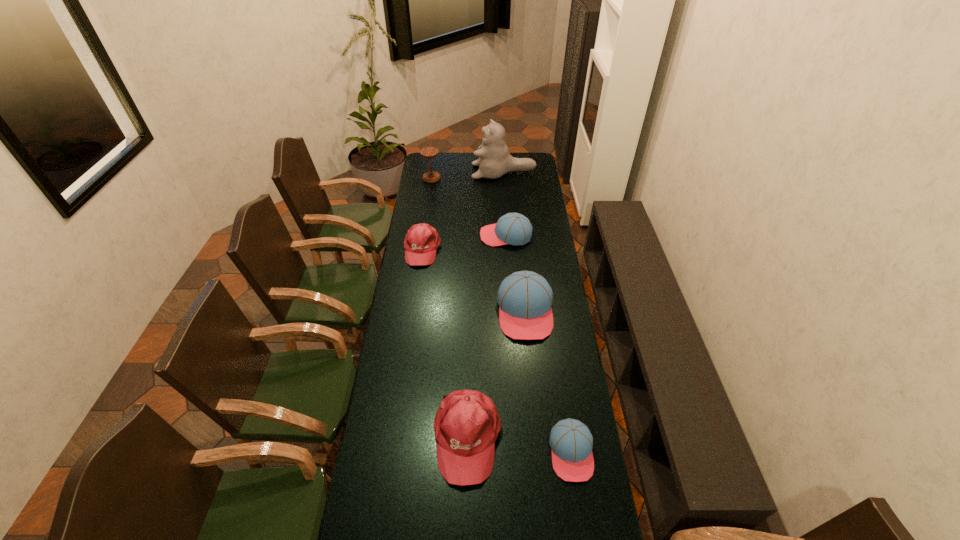
Find the location of a particular element. The image size is (960, 540). the shortest object is located at coordinates (571, 442).

You are a GUI agent. You are given a task and a screenshot of the screen. Output one action in this format:
    pyautogui.click(x=<x>, y=<y>)
    Task: Click on the shortest baseball cap
    This screenshot has height=540, width=960.
    Given the screenshot: What is the action you would take?
    pyautogui.click(x=571, y=442)

Identify the location of free spot located on the face of the tallest object. (439, 172).

You are a GUI agent. You are given a task and a screenshot of the screen. Output one action in this format:
    pyautogui.click(x=<x>, y=<y>)
    Task: Click on the vacant space situated on the face of the tallest object
    The width and height of the screenshot is (960, 540).
    Given the screenshot: What is the action you would take?
    pyautogui.click(x=452, y=172)

The width and height of the screenshot is (960, 540). Identify the location of blank space located 0.110m on the face of the tallest object. [453, 172].

Locate an element on the screen. This screenshot has width=960, height=540. vacant position located on the front of the hourglass is located at coordinates (425, 223).

Identify the location of free region located 0.280m on the front-facing side of the second farthest blue baseball cap. (534, 407).

Where is `free space located 0.120m at the front of the right red baseball cap with the brim`? The image size is (960, 540). free space located 0.120m at the front of the right red baseball cap with the brim is located at coordinates (466, 531).

The width and height of the screenshot is (960, 540). I want to click on vacant region located 0.110m on the front-facing side of the farthest blue baseball cap, so click(x=458, y=235).

Find the location of a particular element. vacant space situated on the front-facing side of the farthest blue baseball cap is located at coordinates (x=427, y=235).